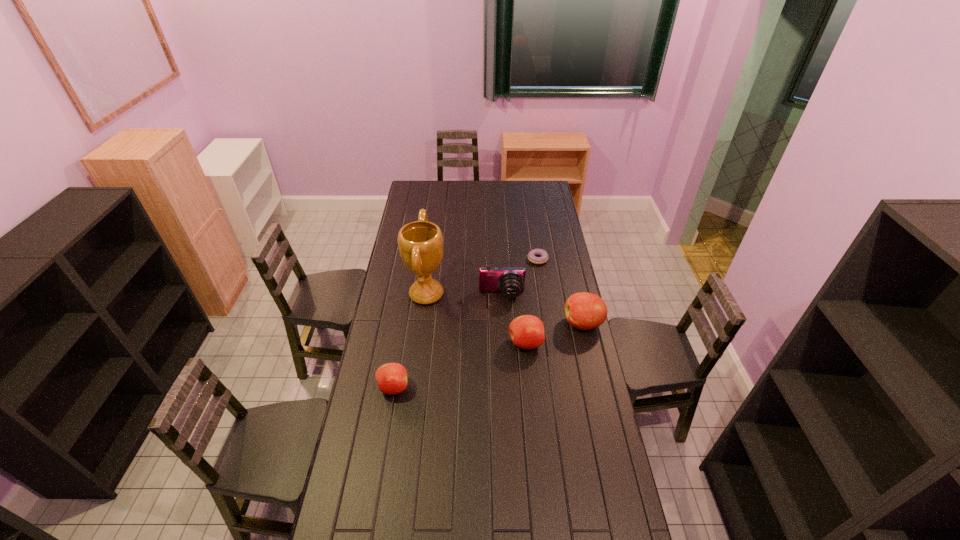
Locate an element on the screen. free space between the second tallest apple and the tallest object is located at coordinates [x=476, y=319].

Locate an element on the screen. The image size is (960, 540). free space between the tallest object and the rightmost apple is located at coordinates (505, 309).

This screenshot has height=540, width=960. Find the location of `blank region between the second apple from left to right and the leftmost apple`. blank region between the second apple from left to right and the leftmost apple is located at coordinates (459, 365).

Where is `object that is the third closest to the award`? Image resolution: width=960 pixels, height=540 pixels. object that is the third closest to the award is located at coordinates (526, 331).

Where is `object that can be found as the fourth closest to the farthest object`? The height and width of the screenshot is (540, 960). object that can be found as the fourth closest to the farthest object is located at coordinates (526, 331).

Find the location of `apple that is the third closest to the camera`. apple that is the third closest to the camera is located at coordinates (391, 378).

Select which apple is the closest to the leftmost apple. Please provide its 2D coordinates. Your answer should be formatted as a tuple, i.e. [(x, y)], where the tuple contains the x and y coordinates of a point satisfying the conditions above.

[(526, 331)]

At what (x,y) coordinates should I click in order to perform the action: click on free space in the image that satisfies the following two spatial constraints: 1. on the front-facing side of the camera; 2. on the left side of the second apple from left to right. Please return your answer as a coordinate pair (x, y). The image size is (960, 540). Looking at the image, I should click on (504, 343).

This screenshot has height=540, width=960. What are the coordinates of `free location that satisfies the following two spatial constraints: 1. on the front-facing side of the camera; 2. on the right side of the rightmost object` in the screenshot? It's located at (503, 323).

The height and width of the screenshot is (540, 960). What are the coordinates of `vacant point that satisfies the following two spatial constraints: 1. on the front-facing side of the second apple from right to left; 2. on the left side of the camera` in the screenshot? It's located at (504, 343).